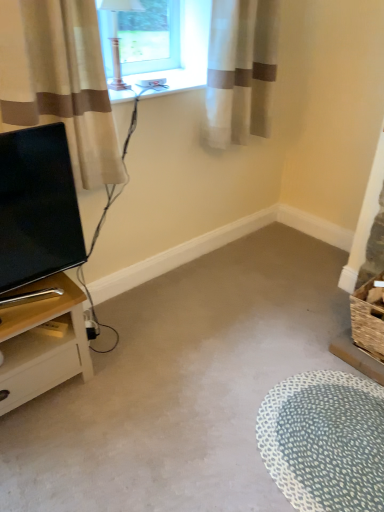
Question: Is white dotted rug at lower right surrounded by matte black tv at left?

Choices:
 (A) no
 (B) yes

Answer: (A)

Question: From the image's perspective, would you say matte black tv at left is positioned over white dotted rug at lower right?

Choices:
 (A) no
 (B) yes

Answer: (B)

Question: Is matte black tv at left looking in the opposite direction of white dotted rug at lower right?

Choices:
 (A) yes
 (B) no

Answer: (B)

Question: From the image's perspective, is matte black tv at left under white dotted rug at lower right?

Choices:
 (A) yes
 (B) no

Answer: (B)

Question: Can you confirm if matte black tv at left is positioned to the right of white dotted rug at lower right?

Choices:
 (A) yes
 (B) no

Answer: (B)

Question: From the image's perspective, is white plastic window sill at upper center located above or below beige fabric curtain at left, the first curtain from the left?

Choices:
 (A) above
 (B) below

Answer: (A)

Question: From a real-world perspective, is white plastic window sill at upper center above or below beige fabric curtain at left, acting as the second curtain starting from the back?

Choices:
 (A) above
 (B) below

Answer: (B)

Question: Is white plastic window sill at upper center wider or thinner than beige fabric curtain at left, the first curtain from the left?

Choices:
 (A) wide
 (B) thin

Answer: (A)

Question: Based on their positions, is white plastic window sill at upper center located to the left or right of beige fabric curtain at left, the first curtain from the left?

Choices:
 (A) left
 (B) right

Answer: (B)

Question: Is point coord(135,87) positioned closer to the camera than point coord(6,353)?

Choices:
 (A) closer
 (B) farther

Answer: (B)

Question: In the image, is white plastic window sill at upper center positioned in front of or behind light wood nightstand at left?

Choices:
 (A) behind
 (B) front

Answer: (A)

Question: Is white plastic window sill at upper center bigger or smaller than light wood nightstand at left?

Choices:
 (A) small
 (B) big

Answer: (A)

Question: Considering the positions of white plastic window sill at upper center and light wood nightstand at left in the image, is white plastic window sill at upper center taller or shorter than light wood nightstand at left?

Choices:
 (A) tall
 (B) short

Answer: (B)

Question: Is matte black tv at left spatially inside white dotted rug at lower right, or outside of it?

Choices:
 (A) outside
 (B) inside

Answer: (A)

Question: Based on their sizes in the image, would you say matte black tv at left is bigger or smaller than white dotted rug at lower right?

Choices:
 (A) small
 (B) big

Answer: (B)